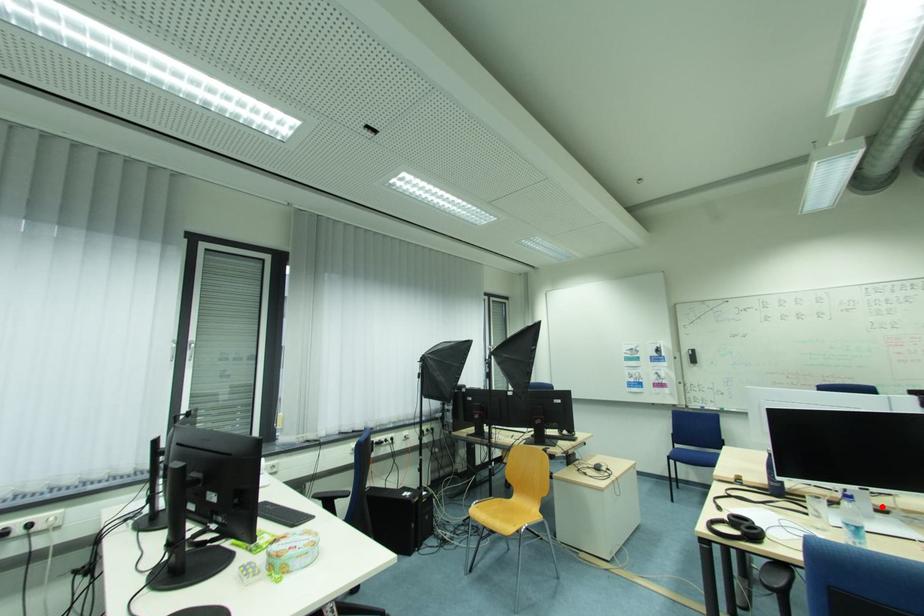
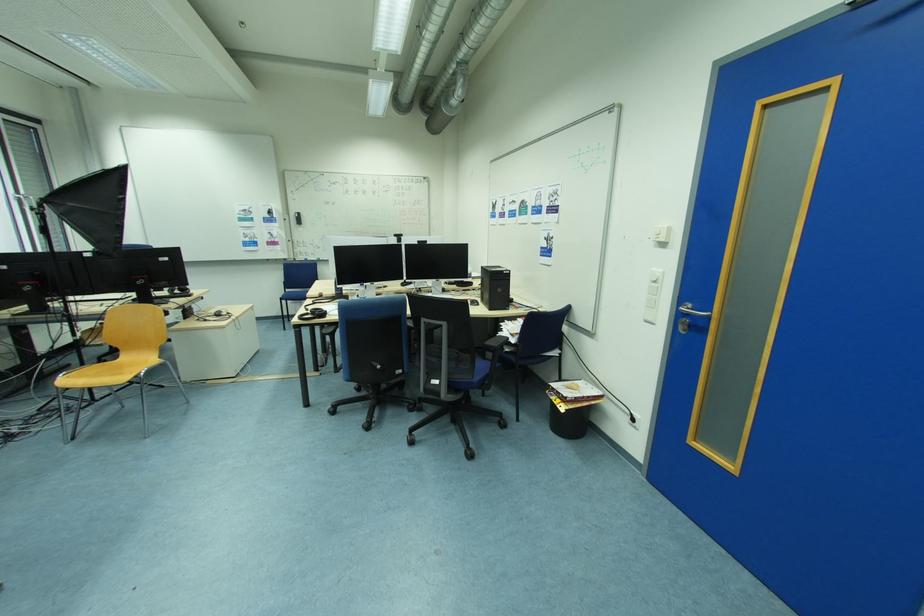
Question: I am providing you with two images of the same scene from different viewpoints. Image1 has a red point marked. In image2, the corresponding 3D location appears at what relative position? Reply with the corresponding letter.

Choices:
 (A) Closer
 (B) Farther

Answer: (A)